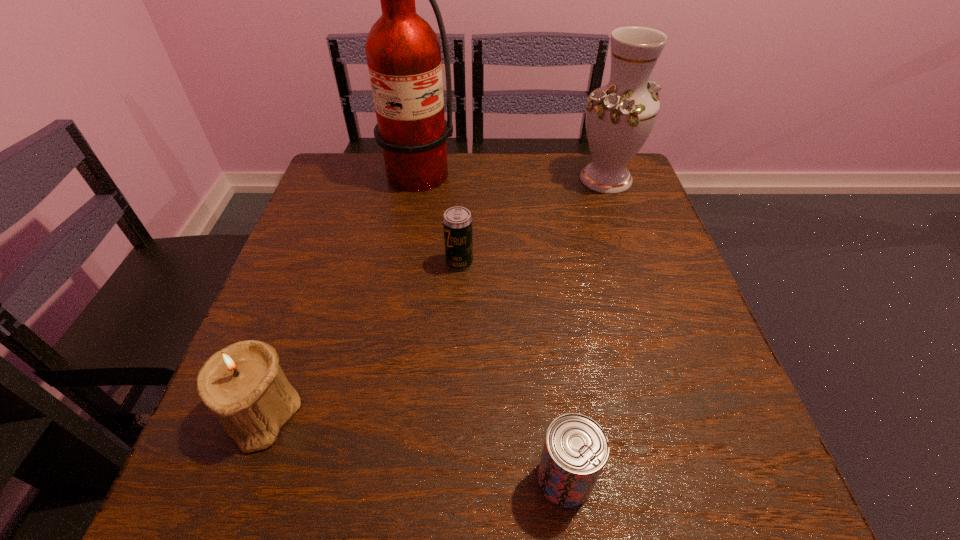
This screenshot has height=540, width=960. Find the location of `vacant space that is in between the tallest object and the candle_holder`. vacant space that is in between the tallest object and the candle_holder is located at coordinates (332, 294).

Image resolution: width=960 pixels, height=540 pixels. What are the coordinates of `unoccupied position between the rightmost object and the nearer beer can` in the screenshot? It's located at (586, 329).

Image resolution: width=960 pixels, height=540 pixels. I want to click on blank region between the left beer can and the tallest object, so click(431, 219).

You are a GUI agent. You are given a task and a screenshot of the screen. Output one action in this format:
    pyautogui.click(x=<x>, y=<y>)
    Task: Click on the blank region between the rightmost object and the third shortest object
    Image resolution: width=960 pixels, height=540 pixels.
    Given the screenshot: What is the action you would take?
    pyautogui.click(x=433, y=296)

Find the location of a particular element. free space between the vase and the third tallest object is located at coordinates 433,296.

Where is `vacant space that's between the farther beer can and the nearer beer can`? This screenshot has width=960, height=540. vacant space that's between the farther beer can and the nearer beer can is located at coordinates (512, 371).

This screenshot has height=540, width=960. What are the coordinates of `vacant space that's between the fourth object from left to right and the left beer can` in the screenshot? It's located at (512, 371).

At what (x,y) coordinates should I click in order to perform the action: click on object that is the second closest to the fourth object from left to right. Please return your answer as a coordinate pair (x, y). The height and width of the screenshot is (540, 960). Looking at the image, I should click on (457, 222).

Select which object appears as the second closest to the right beer can. Please provide its 2D coordinates. Your answer should be formatted as a tuple, i.e. [(x, y)], where the tuple contains the x and y coordinates of a point satisfying the conditions above.

[(457, 222)]

Locate an element on the screen. The width and height of the screenshot is (960, 540). free location that satisfies the following two spatial constraints: 1. on the nozzle and handle of the left beer can; 2. on the left side of the tallest object is located at coordinates (385, 262).